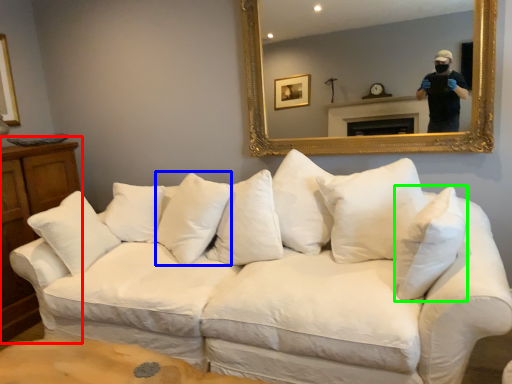
Question: Which is farther away from dresser (highlighted by a red box)? pillow (highlighted by a blue box) or pillow (highlighted by a green box)?

Choices:
 (A) pillow
 (B) pillow

Answer: (B)